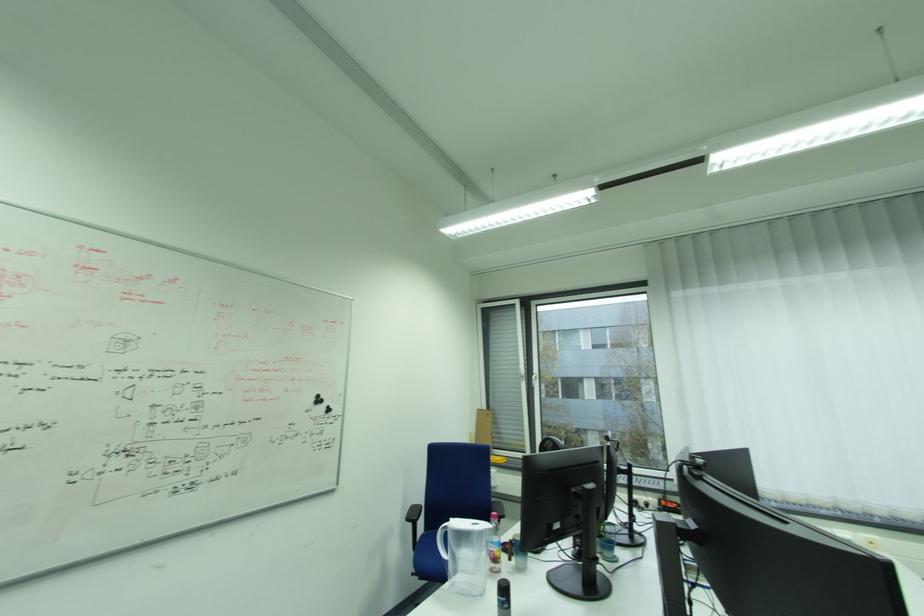
What do you see at coordinates (442, 541) in the screenshot?
I see `the pitcher handle` at bounding box center [442, 541].